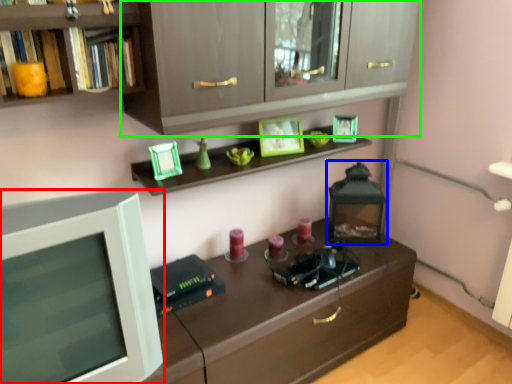
Question: Which object is positioned farthest from computer monitor (highlighted by a red box)? Select from appliance (highlighted by a blue box) and cabinetry (highlighted by a green box).

Choices:
 (A) appliance
 (B) cabinetry

Answer: (A)